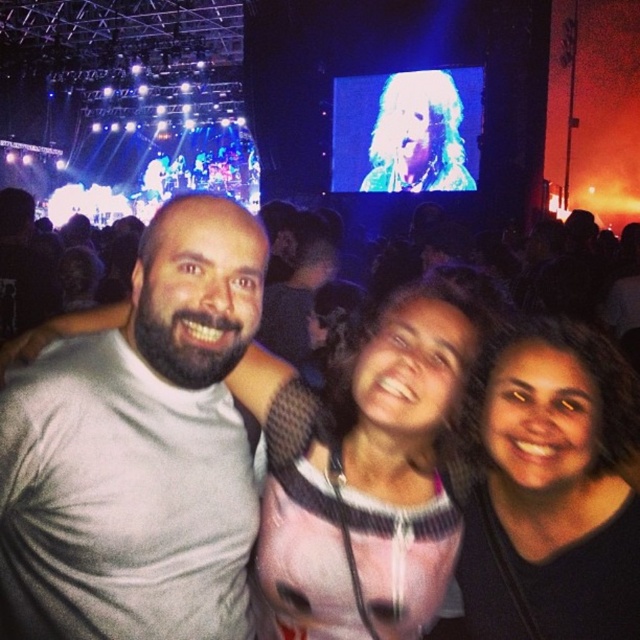
Question: Based on their relative distances, which object is farther from the pink mesh top at center?

Choices:
 (A) dark hair at center
 (B) gray matte t-shirt at left

Answer: (B)

Question: Which is nearer to the gray matte t-shirt at left?

Choices:
 (A) pink mesh top at center
 (B) dark hair at center

Answer: (A)

Question: Does gray matte t-shirt at left have a greater width compared to pink mesh top at center?

Choices:
 (A) no
 (B) yes

Answer: (A)

Question: Is the position of pink mesh top at center more distant than that of dark hair at center?

Choices:
 (A) no
 (B) yes

Answer: (B)

Question: Estimate the real-world distances between objects in this image. Which object is closer to the dark hair at center?

Choices:
 (A) gray matte t-shirt at left
 (B) pink mesh top at center

Answer: (B)

Question: Is gray matte t-shirt at left wider than dark hair at center?

Choices:
 (A) no
 (B) yes

Answer: (B)